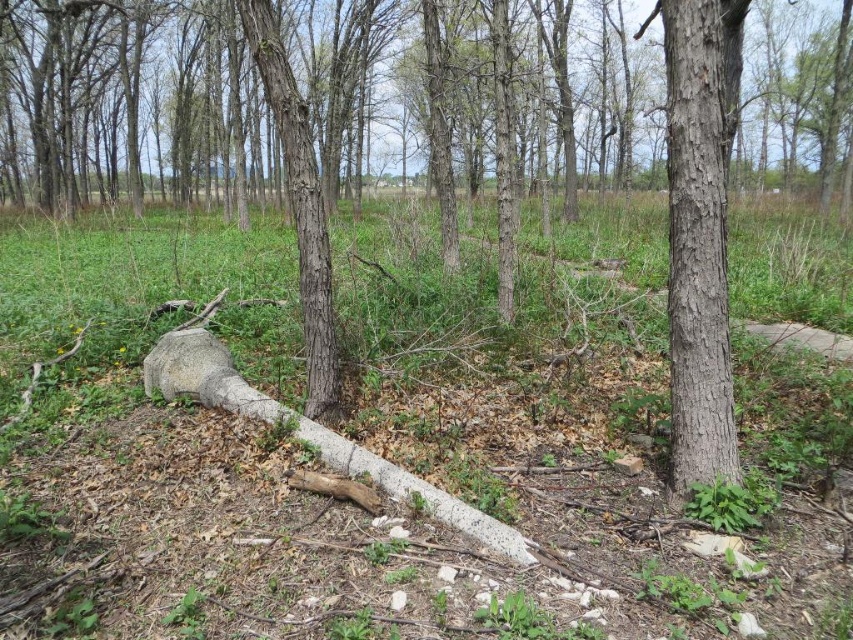
Which of these two, smooth brown bark at right or smooth bark tree trunk at center, stands taller?

smooth brown bark at right is taller.

Between point (728, 86) and point (309, 166), which one is positioned behind?

The point (728, 86) is more distant.

Locate an element on the screen. This screenshot has width=853, height=640. smooth brown bark at right is located at coordinates (699, 234).